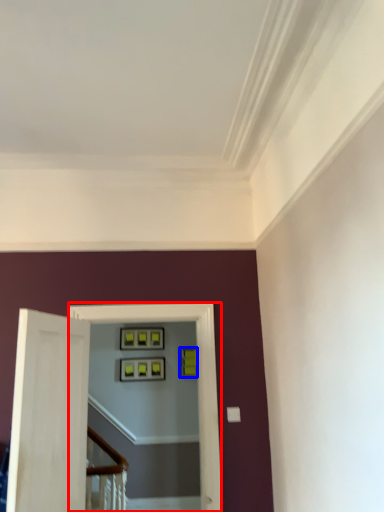
Question: Which object is further to the camera taking this photo, passage (highlighted by a red box) or picture frame (highlighted by a blue box)?

Choices:
 (A) passage
 (B) picture frame

Answer: (B)